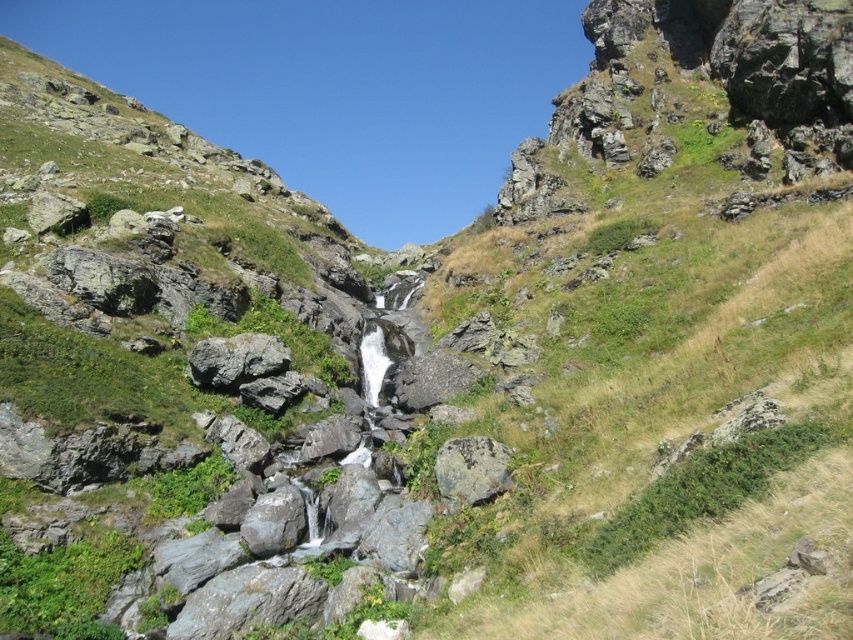
Question: In this image, where is gray rough rock at center located relative to rusty metallic rock at center?

Choices:
 (A) below
 (B) above

Answer: (B)

Question: Which of the following is the farthest from the observer?

Choices:
 (A) (224, 380)
 (B) (479, 449)

Answer: (A)

Question: Which point is closer to the camera?

Choices:
 (A) rusty metallic rock at center
 (B) gray rough rock at center

Answer: (A)

Question: Is gray rough rock at center in front of rusty metallic rock at center?

Choices:
 (A) no
 (B) yes

Answer: (A)

Question: Is gray rough rock at center closer to camera compared to rusty metallic rock at center?

Choices:
 (A) no
 (B) yes

Answer: (A)